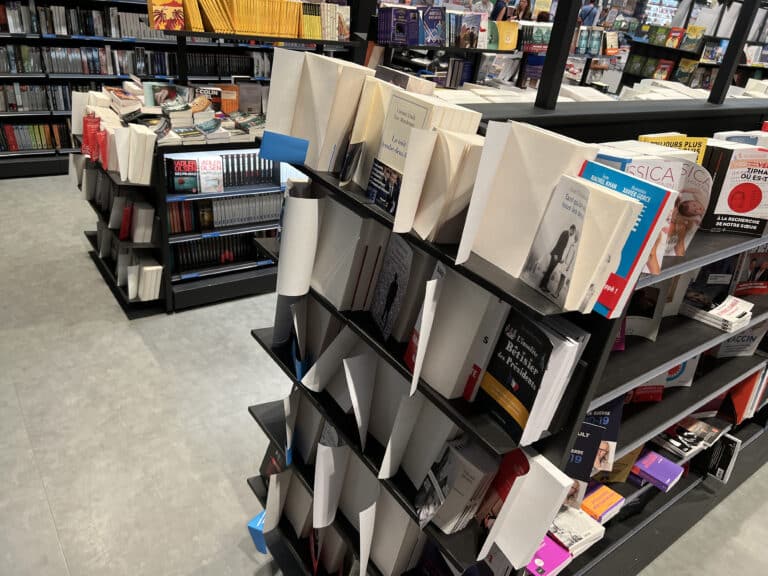
Locate an element on the screen. This screenshot has width=768, height=576. empty space in front of books is located at coordinates (611, 378).